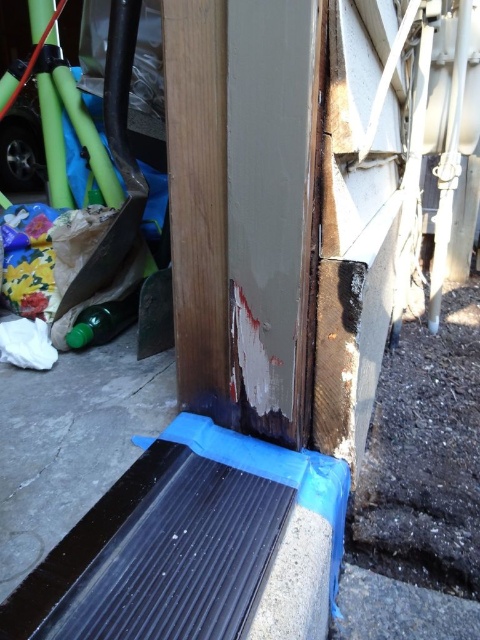
Who is lower down, smooth concrete at lower center or green translucent bottle at lower left?

smooth concrete at lower center is below.

Measure the distance between smooth concrete at lower center and camera.

They are 71.08 centimeters apart.

Is point (54, 483) positioned before point (78, 348)?

Yes.

The height and width of the screenshot is (640, 480). I want to click on smooth concrete at lower center, so click(x=71, y=442).